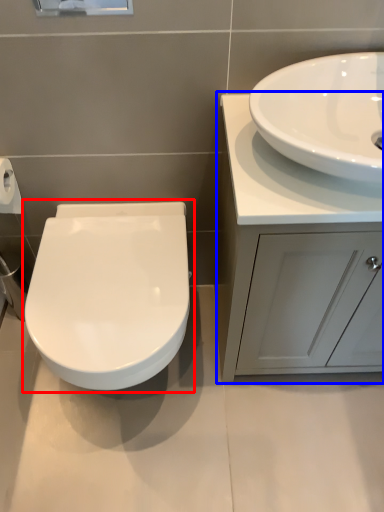
Question: Which object is further to the camera taking this photo, toilet (highlighted by a red box) or bathroom cabinet (highlighted by a blue box)?

Choices:
 (A) toilet
 (B) bathroom cabinet

Answer: (A)